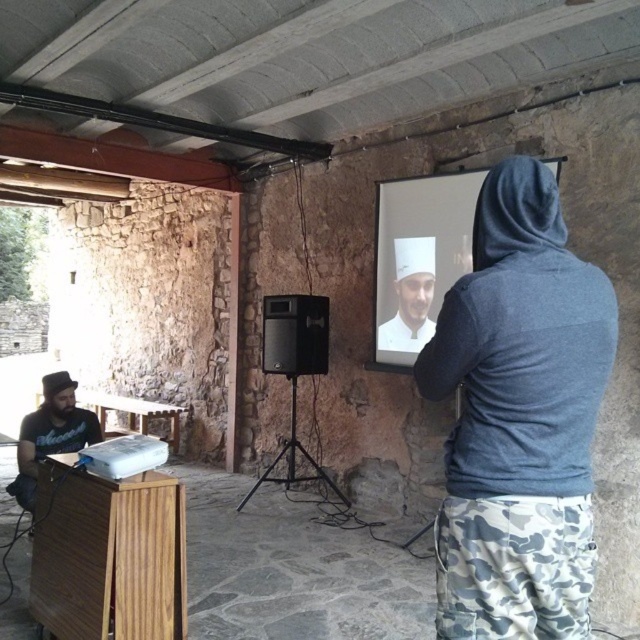
Describe the element at coordinates (419, 259) in the screenshot. I see `white glossy projection screen at center` at that location.

Which is above, white glossy projection screen at center or white matte chef hat at upper center?

Positioned higher is white glossy projection screen at center.

Who is more forward, [477,186] or [396,291]?

Point [477,186] is more forward.

I want to click on white glossy projection screen at center, so click(419, 259).

Is point (406, 342) farther from viewer compared to point (61, 428)?

Yes, it is behind point (61, 428).

Which is above, white glossy projection screen at center or black matte t-shirt at left?

Positioned higher is white glossy projection screen at center.

Who is more distant from viewer, (x=387, y=282) or (x=10, y=490)?

Positioned behind is point (x=387, y=282).

The width and height of the screenshot is (640, 640). I want to click on white glossy projection screen at center, so click(x=419, y=259).

Is black matte t-shirt at left above white matte chef hat at upper center?

Actually, black matte t-shirt at left is below white matte chef hat at upper center.

How much distance is there between black matte t-shirt at left and white matte chef hat at upper center?

black matte t-shirt at left and white matte chef hat at upper center are 2.23 meters apart.

Between point (67, 424) and point (397, 307), which one is positioned in front?

Point (67, 424)

This screenshot has height=640, width=640. In order to click on black matte t-shirt at left in this screenshot , I will do `click(51, 433)`.